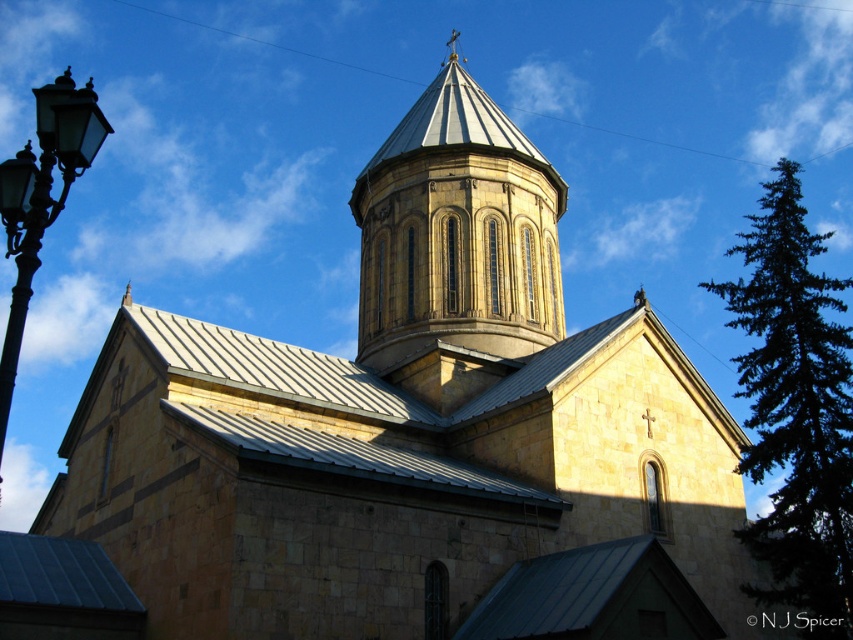
Question: Estimate the real-world distances between objects in this image. Which object is farther from the golden stone tower at center?

Choices:
 (A) dark green coniferous tree at right
 (B) black glass streetlight at left

Answer: (B)

Question: Does golden stone tower at center appear on the right side of black glass streetlight at left?

Choices:
 (A) no
 (B) yes

Answer: (B)

Question: Which point appears farthest from the camera in this image?

Choices:
 (A) (6, 256)
 (B) (830, 460)

Answer: (B)

Question: Which is farther from the dark green coniferous tree at right?

Choices:
 (A) golden stone tower at center
 (B) black glass streetlight at left

Answer: (B)

Question: Can you confirm if dark green coniferous tree at right is positioned to the right of black glass streetlight at left?

Choices:
 (A) yes
 (B) no

Answer: (A)

Question: Can you confirm if golden stone tower at center is positioned above dark green coniferous tree at right?

Choices:
 (A) no
 (B) yes

Answer: (B)